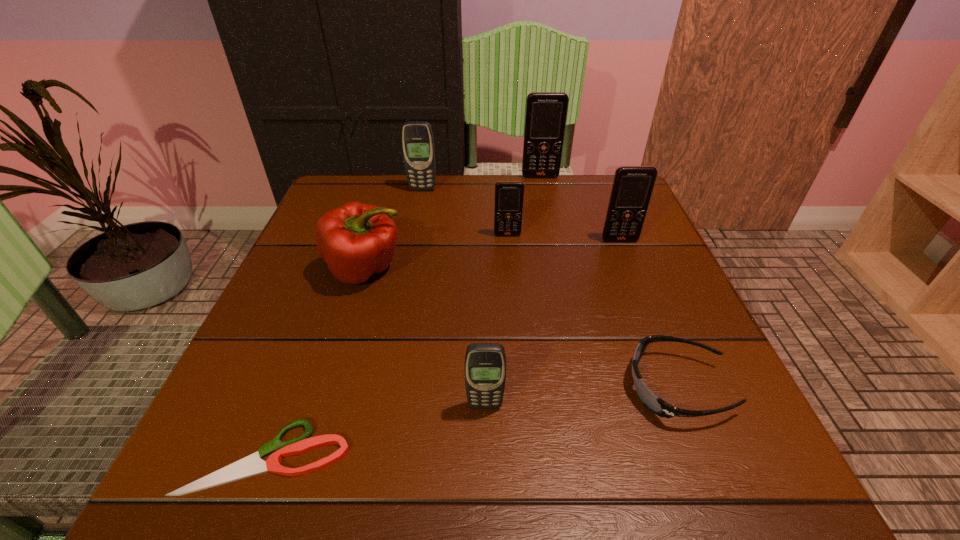
This screenshot has height=540, width=960. I want to click on object that is at the near left corner, so click(x=252, y=465).

This screenshot has width=960, height=540. Find the location of `vacant region at the far edge of the desktop`. vacant region at the far edge of the desktop is located at coordinates click(413, 204).

This screenshot has width=960, height=540. Find the location of `free space at the near edge`. free space at the near edge is located at coordinates (564, 444).

Where is `vacant space at the left edge of the desktop`? Image resolution: width=960 pixels, height=540 pixels. vacant space at the left edge of the desktop is located at coordinates (231, 422).

Where is `free region at the right edge`? free region at the right edge is located at coordinates (651, 349).

At what (x,y) coordinates should I click in order to perform the action: click on vacant space at the far left corner. Please return your answer as a coordinate pair (x, y). Looking at the image, I should click on (310, 224).

At what (x,y) coordinates should I click in order to perform the action: click on vacant space at the far right corner of the desktop. Please return your answer as a coordinate pair (x, y). The height and width of the screenshot is (540, 960). Looking at the image, I should click on pyautogui.click(x=608, y=185).

Where is `free area in between the nearest orange cellular telephone and the tallest cellular telephone`? This screenshot has height=540, width=960. free area in between the nearest orange cellular telephone and the tallest cellular telephone is located at coordinates (580, 208).

Image resolution: width=960 pixels, height=540 pixels. Identify the location of vacant space that's between the rightmost orange cellular telephone and the third farthest object. (564, 238).

Where is `blank region between the pink bell pepper and the leftmost orange cellular telephone`? This screenshot has height=540, width=960. blank region between the pink bell pepper and the leftmost orange cellular telephone is located at coordinates (437, 253).